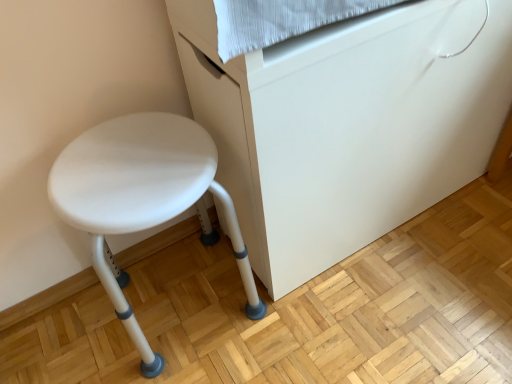
In order to click on white plastic stool at left in this screenshot , I will do `click(141, 196)`.

The width and height of the screenshot is (512, 384). What do you see at coordinates (141, 196) in the screenshot?
I see `white plastic stool at left` at bounding box center [141, 196].

What do you see at coordinates (347, 124) in the screenshot? This screenshot has height=384, width=512. I see `white plastic stool at lower left` at bounding box center [347, 124].

Locate an element on the screen. The height and width of the screenshot is (384, 512). white plastic stool at lower left is located at coordinates (347, 124).

Looking at this image, what is the approximate width of white plastic stool at lower left?

white plastic stool at lower left is 12.76 inches wide.

I want to click on white plastic stool at left, so click(x=141, y=196).

Which is more to the right, white plastic stool at left or white plastic stool at lower left?

white plastic stool at lower left.

Is white plastic stool at left in front of white plastic stool at lower left?

No, white plastic stool at left is behind white plastic stool at lower left.

Between point (174, 124) and point (244, 222), which one is positioned behind?

Point (244, 222)

From the image's perspective, is white plastic stool at left below white plastic stool at lower left?

Indeed, from the image's perspective, white plastic stool at left is shown beneath white plastic stool at lower left.

From a real-world perspective, is white plastic stool at left located beneath white plastic stool at lower left?

Correct, in the physical world, white plastic stool at left is lower than white plastic stool at lower left.

Can you confirm if white plastic stool at left is wider than white plastic stool at lower left?

Correct, the width of white plastic stool at left exceeds that of white plastic stool at lower left.

Does white plastic stool at left have a lesser height compared to white plastic stool at lower left?

Yes.

Can you confirm if white plastic stool at left is bigger than white plastic stool at lower left?

Actually, white plastic stool at left might be smaller than white plastic stool at lower left.

Is white plastic stool at lower left surrounded by white plastic stool at left?

No, white plastic stool at lower left is located outside of white plastic stool at left.

Is the surface of white plastic stool at left in direct contact with white plastic stool at lower left?

No.

Is white plastic stool at left looking in the opposite direction of white plastic stool at lower left?

white plastic stool at left is not turned away from white plastic stool at lower left.

How different are the orientations of white plastic stool at left and white plastic stool at lower left in degrees?

The angular difference between white plastic stool at left and white plastic stool at lower left is 1.36 degrees.

Find the location of `furniture above the white plastic stool at left (from a real-world perspective)`. furniture above the white plastic stool at left (from a real-world perspective) is located at coordinates (347, 124).

Between white plastic stool at lower left and white plastic stool at left, which one appears on the right side from the viewer's perspective?

white plastic stool at lower left.

Relative to white plastic stool at left, is white plastic stool at lower left in front or behind?

white plastic stool at lower left is positioned closer to the viewer than white plastic stool at left.

Between point (436, 127) and point (155, 113), which one is positioned in front?

The point (155, 113) is more forward.

From the image's perspective, is white plastic stool at lower left located above white plastic stool at left?

Correct, white plastic stool at lower left appears higher than white plastic stool at left in the image.

From a real-world perspective, between white plastic stool at lower left and white plastic stool at left, who is vertically lower?

white plastic stool at left.

Considering the sizes of white plastic stool at lower left and white plastic stool at left in the image, is white plastic stool at lower left wider or thinner than white plastic stool at left?

Clearly, white plastic stool at lower left has less width compared to white plastic stool at left.

Considering the sizes of objects white plastic stool at lower left and white plastic stool at left in the image provided, who is shorter, white plastic stool at lower left or white plastic stool at left?

With less height is white plastic stool at left.

Considering the relative sizes of white plastic stool at lower left and white plastic stool at left in the image provided, is white plastic stool at lower left smaller than white plastic stool at left?

Incorrect, white plastic stool at lower left is not smaller in size than white plastic stool at left.

Is white plastic stool at lower left not within white plastic stool at left?

white plastic stool at lower left lies outside white plastic stool at left's area.

Is white plastic stool at lower left positioned far away from white plastic stool at left?

No, there isn't a large distance between white plastic stool at lower left and white plastic stool at left.

Is white plastic stool at lower left aimed at white plastic stool at left?

No, white plastic stool at lower left is not aimed at white plastic stool at left.

Where is `stool directly beneath the white plastic stool at lower left (from a real-world perspective)`? The image size is (512, 384). stool directly beneath the white plastic stool at lower left (from a real-world perspective) is located at coordinates (141, 196).

Identify the location of furniture above the white plastic stool at left (from the image's perspective). This screenshot has height=384, width=512. (347, 124).

Find the location of a particular element. This screenshot has height=384, width=512. furniture in front of the white plastic stool at left is located at coordinates (347, 124).